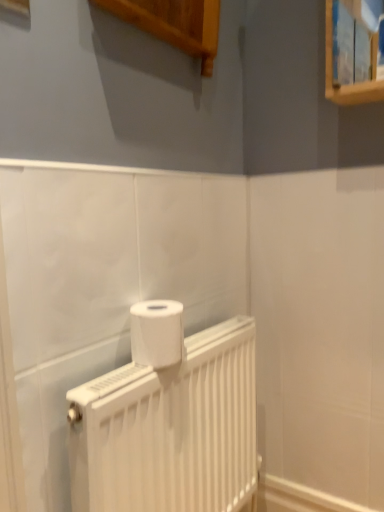
Question: Is white matte toilet paper at center closer to the viewer compared to white matte radiator at center?

Choices:
 (A) yes
 (B) no

Answer: (B)

Question: Does white matte toilet paper at center appear on the left side of white matte radiator at center?

Choices:
 (A) yes
 (B) no

Answer: (A)

Question: Considering the relative sizes of white matte toilet paper at center and white matte radiator at center in the image provided, is white matte toilet paper at center bigger than white matte radiator at center?

Choices:
 (A) no
 (B) yes

Answer: (A)

Question: Is white matte toilet paper at center positioned with its back to white matte radiator at center?

Choices:
 (A) yes
 (B) no

Answer: (B)

Question: Does white matte toilet paper at center turn towards white matte radiator at center?

Choices:
 (A) yes
 (B) no

Answer: (B)

Question: Are white matte toilet paper at center and white matte radiator at center located far from each other?

Choices:
 (A) no
 (B) yes

Answer: (A)

Question: Is white matte radiator at center shorter than white matte toilet paper at center?

Choices:
 (A) yes
 (B) no

Answer: (B)

Question: Is white matte radiator at center oriented away from white matte toilet paper at center?

Choices:
 (A) no
 (B) yes

Answer: (A)

Question: Is there a large distance between white matte radiator at center and white matte toilet paper at center?

Choices:
 (A) no
 (B) yes

Answer: (A)

Question: Is white matte radiator at center to the right of white matte toilet paper at center from the viewer's perspective?

Choices:
 (A) yes
 (B) no

Answer: (A)

Question: Can you confirm if white matte radiator at center is bigger than white matte toilet paper at center?

Choices:
 (A) yes
 (B) no

Answer: (A)

Question: Does white matte radiator at center come behind white matte toilet paper at center?

Choices:
 (A) no
 (B) yes

Answer: (A)

Question: Considering their positions, is white matte radiator at center located in front of or behind white matte toilet paper at center?

Choices:
 (A) behind
 (B) front

Answer: (B)